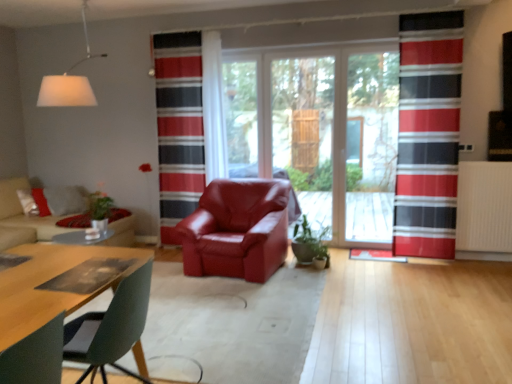
Image resolution: width=512 pixels, height=384 pixels. I want to click on free point in front of satin red armchair at center, so click(x=224, y=304).